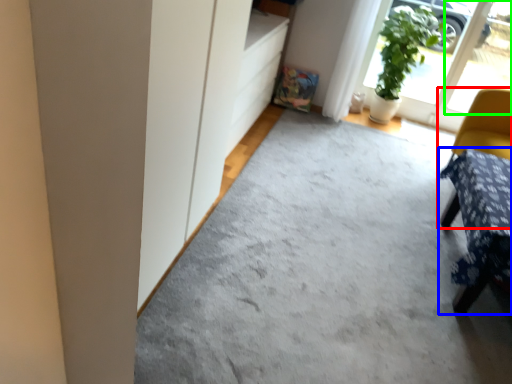
Question: Which object is positioned farthest from chair (highlighted by a red box)? Select from furniture (highlighted by a blue box) and window (highlighted by a green box).

Choices:
 (A) furniture
 (B) window

Answer: (B)